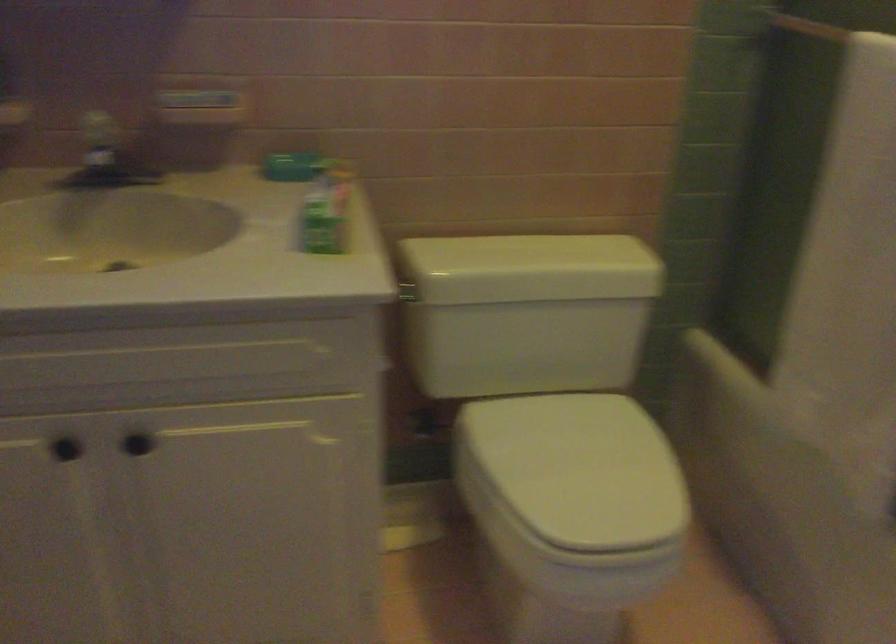
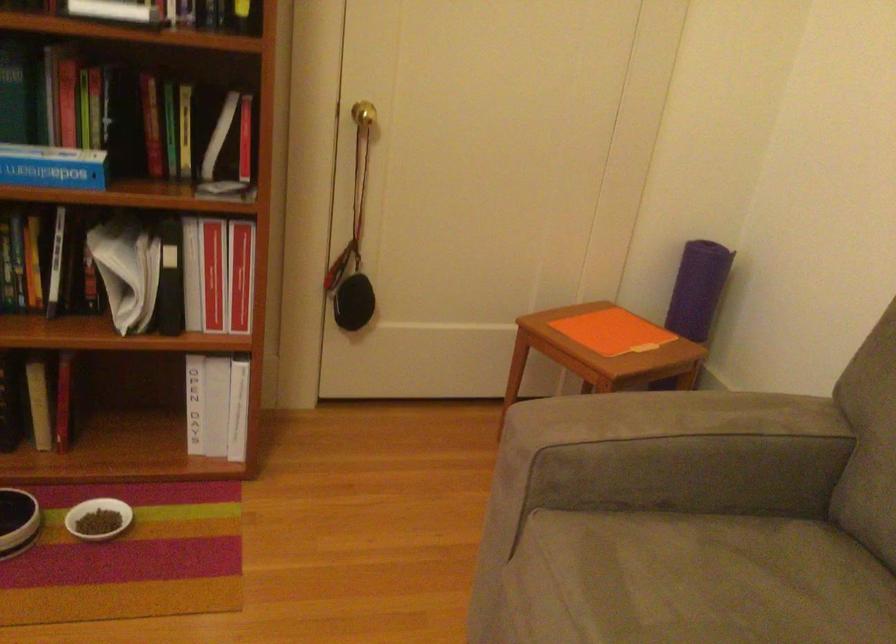
Question: I am providing you with two images of the same scene from different viewpoints. After the viewpoint changes to image2, which objects are now occluded?

Choices:
 (A) purple yoga mat
 (B) brass door knob
 (C) white toilet seat lid
 (D) green rolled mat

Answer: (C)